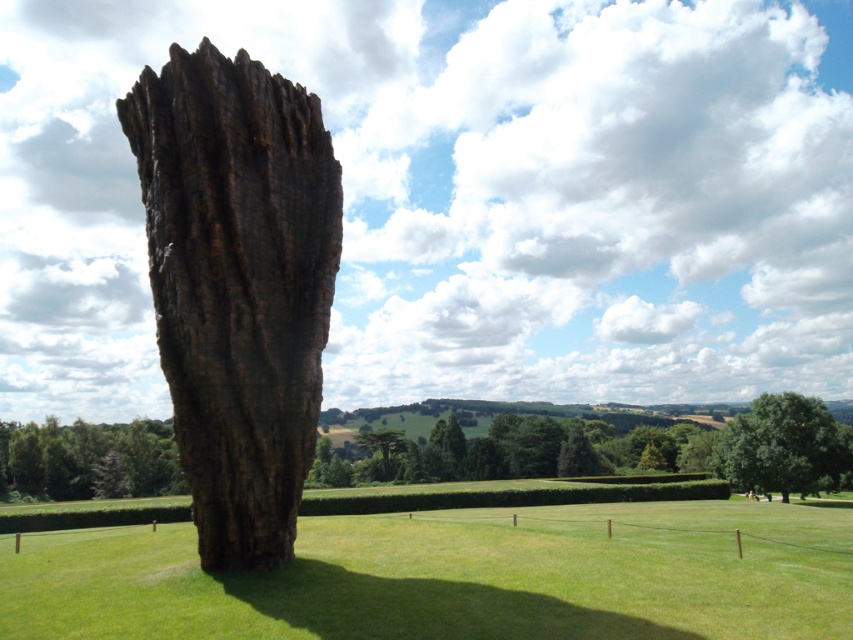
Question: Estimate the real-world distances between objects in this image. Which object is farther from the green grass at center?

Choices:
 (A) rustic wood sculpture at center
 (B) dark brown textured tree trunk at lower left

Answer: (B)

Question: Observing the image, what is the correct spatial positioning of rustic wood sculpture at center in reference to green leafy tree at center?

Choices:
 (A) above
 (B) below

Answer: (A)

Question: Can you confirm if green grass at center is positioned below dark brown textured tree trunk at lower left?

Choices:
 (A) no
 (B) yes

Answer: (A)

Question: Does green grass at center have a lesser width compared to rustic wood sculpture at center?

Choices:
 (A) yes
 (B) no

Answer: (B)

Question: Which point appears closest to the camera in this image?

Choices:
 (A) (73, 426)
 (B) (791, 468)
 (C) (653, 570)

Answer: (C)

Question: Which is nearer to the green leafy tree at center?

Choices:
 (A) green grass at center
 (B) dark brown textured tree trunk at lower left

Answer: (A)